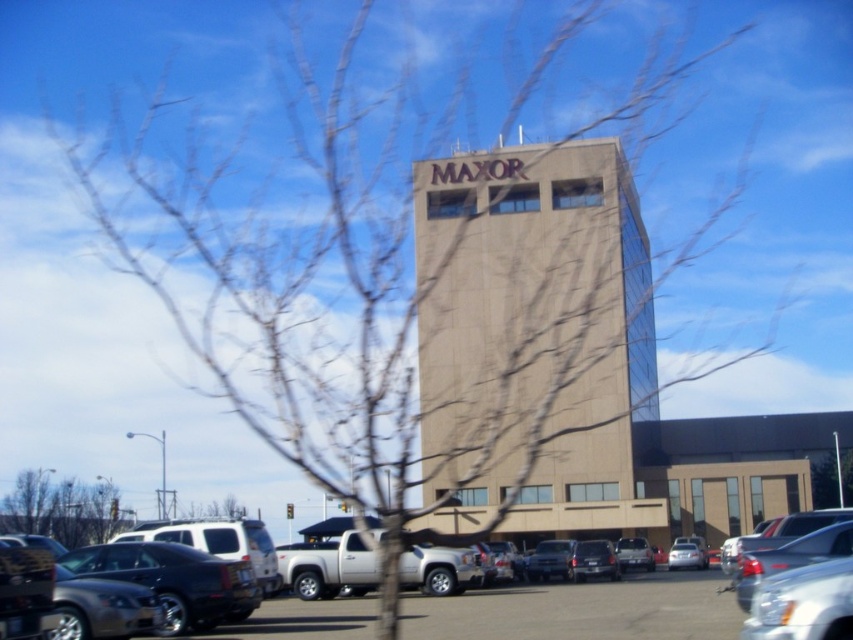
You are a delivery driver approaching the MAXOR building. You need to park your vehicle in the parking lot. If you want to park your car between the satin black sedan at lower left and the matte black suv at center, which vehicle should you position your car closer to?

The satin black sedan at lower left is above the matte black suv at center. To park between them, you should position your car closer to the matte black suv at center since it is lower in the image.

You are standing in front of the MAXOR building and see the satin black sedan at lower left and the matte black suv at center. Which vehicle is positioned more to the left side?

The satin black sedan at lower left is positioned more to the left side than the matte black suv at center.

You are a delivery driver approaching the MAXOR building. You see the beige concrete building at center and the satin silver sedan at lower center. Which object is closer to the front of the scene?

The satin silver sedan at lower center is closer to the front of the scene because the beige concrete building at center is located above it, meaning the sedan is in front.